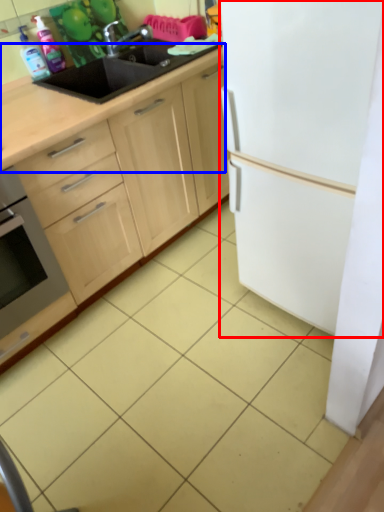
Question: Which point is further to the camera, refrigerator (highlighted by a red box) or countertop (highlighted by a blue box)?

Choices:
 (A) refrigerator
 (B) countertop

Answer: (B)